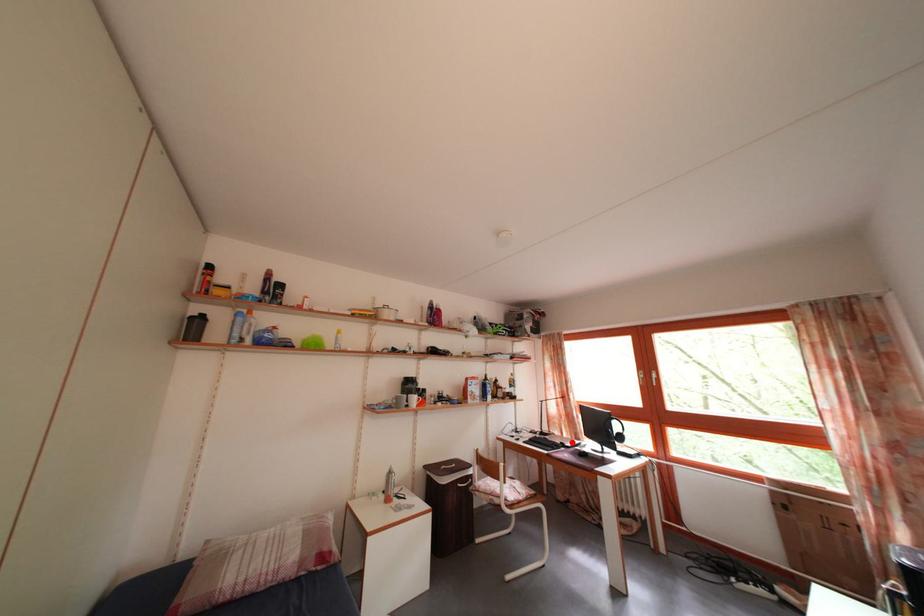
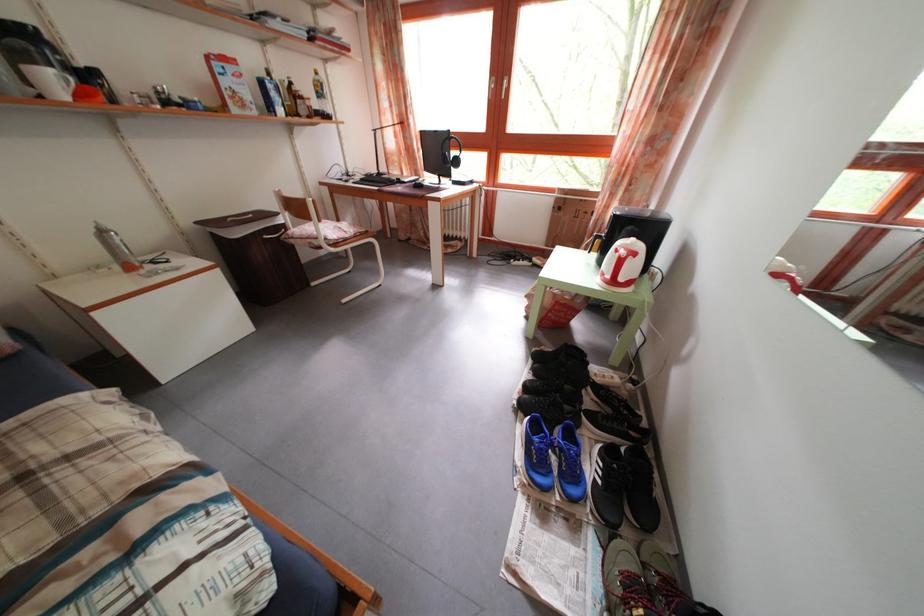
Question: I am providing you with two images of the same scene from different viewpoints. Given a red point in image1, look at the same physical point in image2. Is it:

Choices:
 (A) Closer to the viewpoint
 (B) Farther from the viewpoint

Answer: (A)